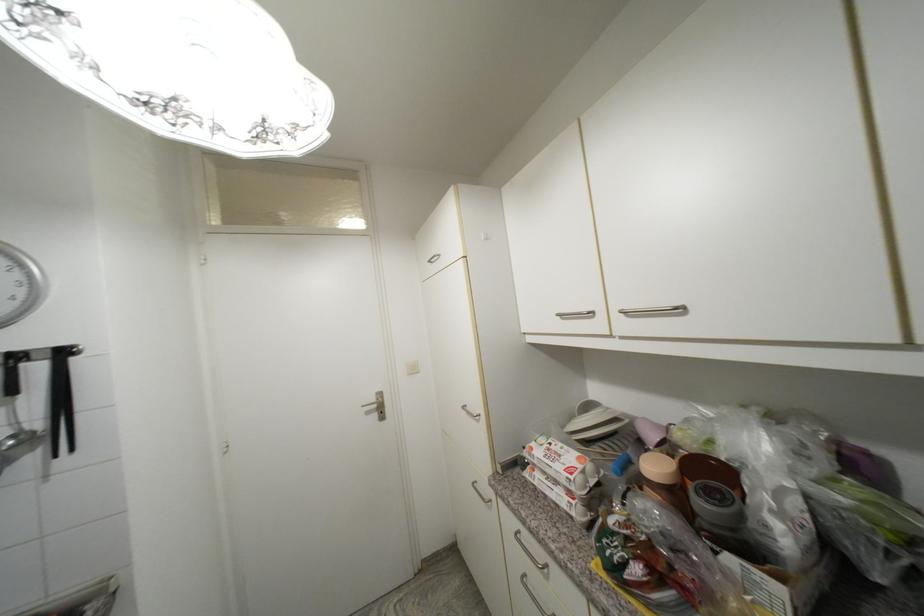
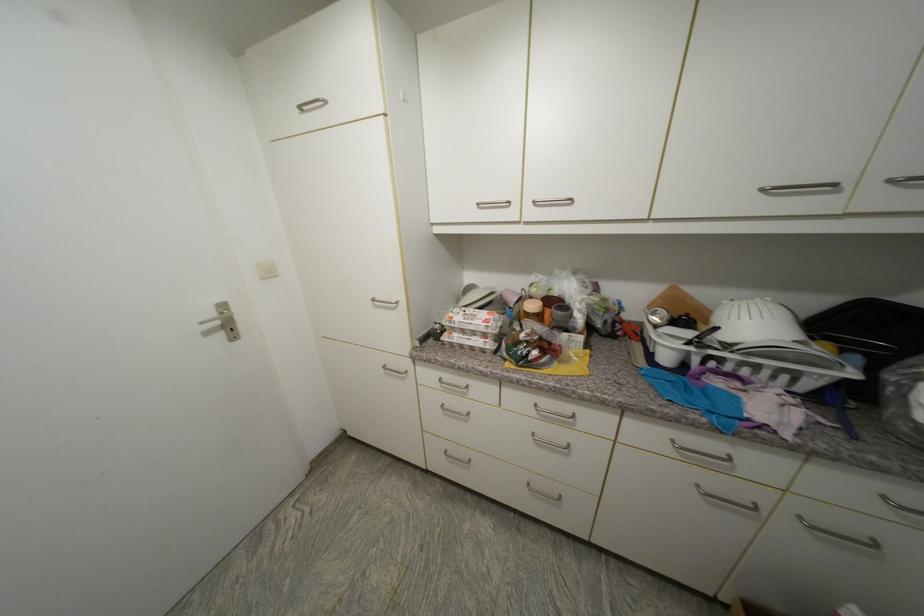
The point at (380, 400) is marked in the first image. Where is the corresponding point in the second image?

(220, 315)